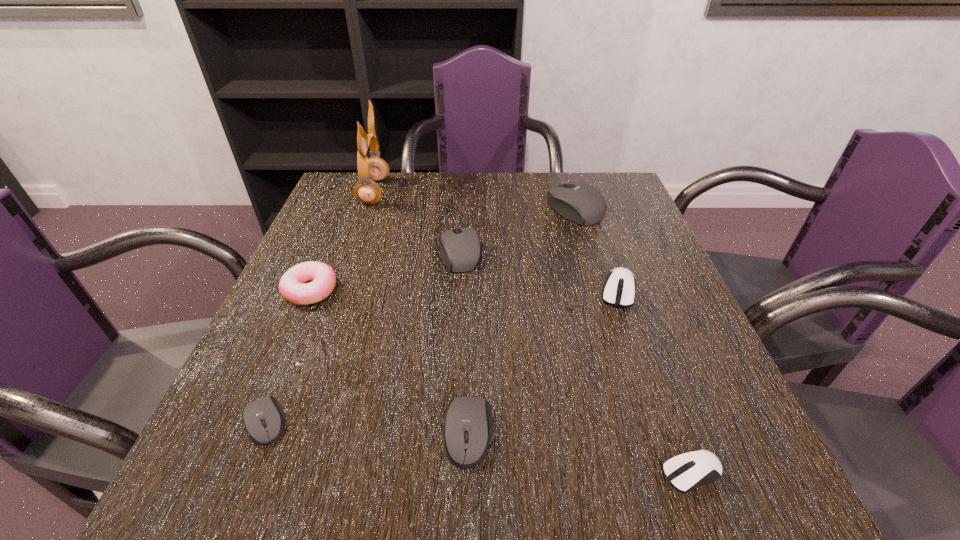
I want to click on free spot that satisfies the following two spatial constraints: 1. on the front-facing side of the earphone; 2. on the left side of the farthest black computer equipment, so click(369, 208).

Find the location of `vacant space that satisfies the following two spatial constraints: 1. on the back side of the pink doughnut; 2. on the left side of the third nearest black computer equipment`. vacant space that satisfies the following two spatial constraints: 1. on the back side of the pink doughnut; 2. on the left side of the third nearest black computer equipment is located at coordinates point(326,253).

The image size is (960, 540). I want to click on free space that satisfies the following two spatial constraints: 1. on the front-facing side of the tallest object; 2. on the right side of the third nearest black computer equipment, so click(352, 253).